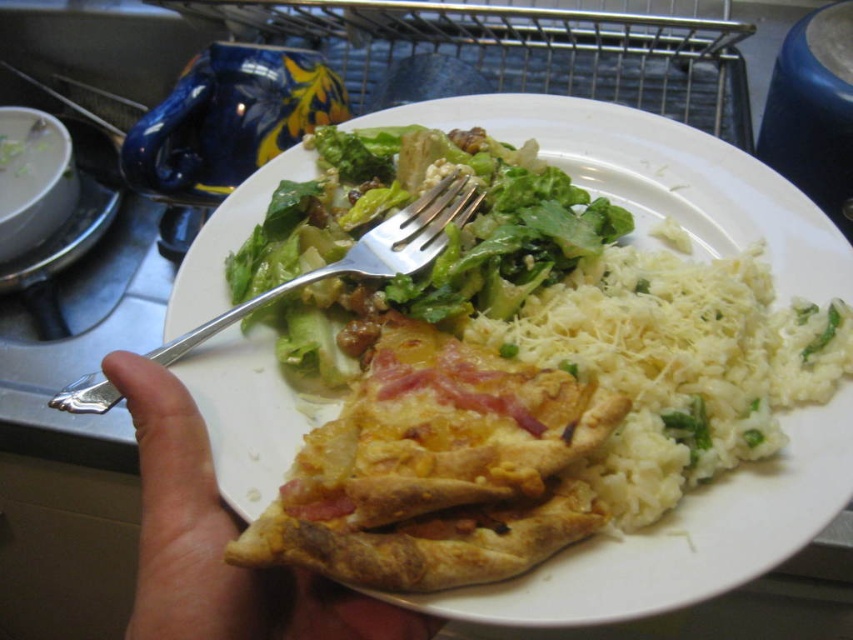
You are a food critic evaluating the presentation of this dish. Based on the placement of the golden brown crispy omelet at center and the silver metallic fork at upper center, can you determine which food item is positioned to the right of the fork?

The golden brown crispy omelet at center is to the right of the silver metallic fork at upper center, so the omelet is positioned to the right of the fork.

You are a food critic evaluating this dish. You need to describe the arrangement of the plate and fork. Where is the white matte plate at center in relation to the silver metallic fork at upper center?

The white matte plate at center is located below the silver metallic fork at upper center.